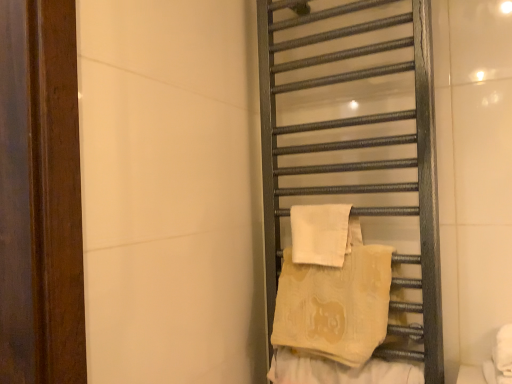
Question: Would you say beige textured towel at center-right is outside white cotton beach towel at right, the 1th beach towel viewed from the top?

Choices:
 (A) yes
 (B) no

Answer: (A)

Question: From the image's perspective, does beige textured towel at center-right appear higher than white cotton beach towel at right, the 2th beach towel positioned from the bottom?

Choices:
 (A) yes
 (B) no

Answer: (B)

Question: From the image's perspective, is beige textured towel at center-right under white cotton beach towel at right, the 2th beach towel positioned from the bottom?

Choices:
 (A) yes
 (B) no

Answer: (A)

Question: Is beige textured towel at center-right taller than white cotton beach towel at right, the 2th beach towel positioned from the bottom?

Choices:
 (A) no
 (B) yes

Answer: (A)

Question: Does beige textured towel at center-right come in front of white cotton beach towel at right, the 1th beach towel viewed from the top?

Choices:
 (A) yes
 (B) no

Answer: (A)

Question: Is metallic towel rack at right to the left or to the right of beige textured towel at center-right in the image?

Choices:
 (A) left
 (B) right

Answer: (B)

Question: Considering the positions of metallic towel rack at right and beige textured towel at center-right in the image, is metallic towel rack at right bigger or smaller than beige textured towel at center-right?

Choices:
 (A) big
 (B) small

Answer: (A)

Question: Is metallic towel rack at right situated inside beige textured towel at center-right or outside?

Choices:
 (A) outside
 (B) inside

Answer: (A)

Question: Is metallic towel rack at right taller or shorter than beige textured towel at center-right?

Choices:
 (A) tall
 (B) short

Answer: (A)

Question: In terms of height, does metallic towel rack at right look taller or shorter compared to beige cotton beach towel at center-right, marked as the first beach towel in a bottom-to-top arrangement?

Choices:
 (A) tall
 (B) short

Answer: (A)

Question: Considering their positions, is metallic towel rack at right located in front of or behind beige cotton beach towel at center-right, marked as the first beach towel in a bottom-to-top arrangement?

Choices:
 (A) front
 (B) behind

Answer: (A)

Question: From the image's perspective, relative to beige cotton beach towel at center-right, acting as the 2th beach towel starting from the top, is metallic towel rack at right above or below?

Choices:
 (A) below
 (B) above

Answer: (B)

Question: Is metallic towel rack at right to the left or to the right of beige cotton beach towel at center-right, marked as the first beach towel in a bottom-to-top arrangement, in the image?

Choices:
 (A) left
 (B) right

Answer: (B)

Question: From the image's perspective, is beige cotton beach towel at center-right, marked as the first beach towel in a bottom-to-top arrangement, located above or below beige textured towel at center-right?

Choices:
 (A) below
 (B) above

Answer: (B)

Question: Is beige cotton beach towel at center-right, marked as the first beach towel in a bottom-to-top arrangement, bigger or smaller than beige textured towel at center-right?

Choices:
 (A) big
 (B) small

Answer: (A)